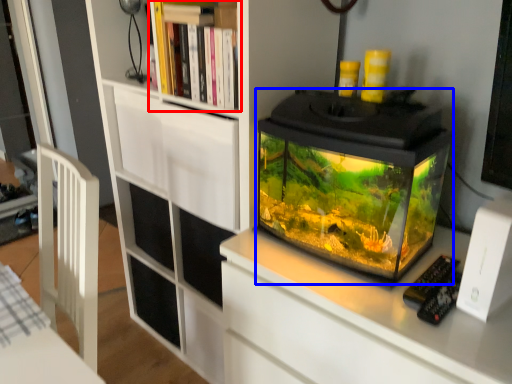
Question: Which object is closer to the camera taking this photo, shelf (highlighted by a red box) or glass box (highlighted by a blue box)?

Choices:
 (A) shelf
 (B) glass box

Answer: (B)